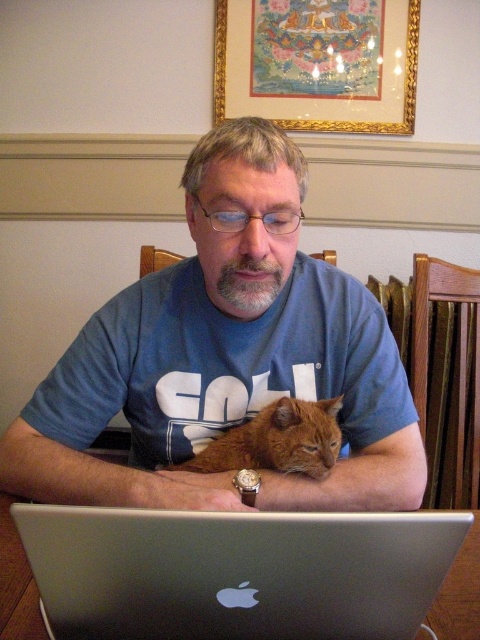
Question: Which of these objects is positioned farthest from the gold-framed artwork at upper center?

Choices:
 (A) blue cotton shirt at center
 (B) silver metallic laptop at lower center

Answer: (B)

Question: Does blue cotton shirt at center appear on the left side of orange fur cat at center?

Choices:
 (A) yes
 (B) no

Answer: (B)

Question: Which object is farther from the camera taking this photo?

Choices:
 (A) blue cotton shirt at center
 (B) gold-framed artwork at upper center

Answer: (B)

Question: Does blue cotton shirt at center appear under silver metallic laptop at lower center?

Choices:
 (A) yes
 (B) no

Answer: (B)

Question: Which point is farther from the camera taking this photo?

Choices:
 (A) (336, 426)
 (B) (403, 24)

Answer: (B)

Question: Is gold-framed artwork at upper center below orange fur cat at center?

Choices:
 (A) no
 (B) yes

Answer: (A)